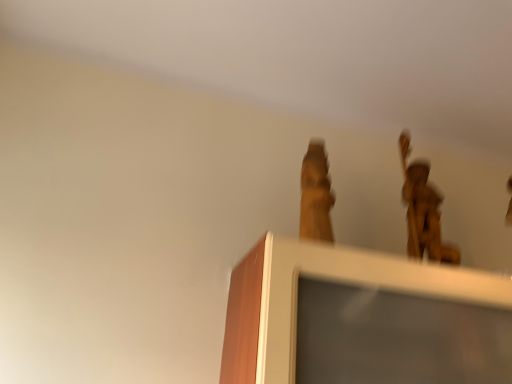
At what (x,y) coordinates should I click in order to perform the action: click on wooden frame at upper center. Please return your answer as a coordinate pair (x, y). Looking at the image, I should click on (362, 319).

Describe the element at coordinates (362, 319) in the screenshot. I see `wooden frame at upper center` at that location.

What is the approximate width of bronze statue at upper right?

It is 12.28 centimeters.

You are a GUI agent. You are given a task and a screenshot of the screen. Output one action in this format:
    pyautogui.click(x=<x>, y=<y>)
    Task: Click on the bronze statue at upper right
    
    Given the screenshot: What is the action you would take?
    pyautogui.click(x=423, y=211)

What do you see at coordinates (423, 211) in the screenshot?
I see `bronze statue at upper right` at bounding box center [423, 211].

Where is `wooden frame at upper center`? This screenshot has height=384, width=512. wooden frame at upper center is located at coordinates (362, 319).

Can you confirm if bronze statue at upper right is positioned to the right of wooden frame at upper center?

Indeed, bronze statue at upper right is positioned on the right side of wooden frame at upper center.

In the scene shown: Relative to wooden frame at upper center, is bronze statue at upper right in front or behind?

bronze statue at upper right is behind wooden frame at upper center.

Between point (405, 160) and point (317, 371), which one is positioned in front?

Positioned in front is point (317, 371).

From the image's perspective, between bronze statue at upper right and wooden frame at upper center, who is located below?

wooden frame at upper center, from the image's perspective.

From a real-world perspective, is bronze statue at upper right physically located above or below wooden frame at upper center?

Clearly, from a real-world perspective, bronze statue at upper right is above wooden frame at upper center.

Considering the relative sizes of bronze statue at upper right and wooden frame at upper center in the image provided, is bronze statue at upper right wider than wooden frame at upper center?

In fact, bronze statue at upper right might be narrower than wooden frame at upper center.

In terms of height, does bronze statue at upper right look taller or shorter compared to wooden frame at upper center?

bronze statue at upper right is taller than wooden frame at upper center.

Considering the relative sizes of bronze statue at upper right and wooden frame at upper center in the image provided, is bronze statue at upper right smaller than wooden frame at upper center?

Yes.

Could wooden frame at upper center be considered to be inside bronze statue at upper right?

That's incorrect, wooden frame at upper center is not inside bronze statue at upper right.

Is bronze statue at upper right not near wooden frame at upper center?

bronze statue at upper right is actually quite close to wooden frame at upper center.

Is bronze statue at upper right looking in the opposite direction of wooden frame at upper center?

No, bronze statue at upper right's orientation is not away from wooden frame at upper center.

What's the angular difference between bronze statue at upper right and wooden frame at upper center's facing directions?

The angular difference between bronze statue at upper right and wooden frame at upper center is 0.000222 degrees.

At what (x,y) coordinates should I click in order to perform the action: click on furniture below the bronze statue at upper right (from a real-world perspective). Please return your answer as a coordinate pair (x, y). The width and height of the screenshot is (512, 384). Looking at the image, I should click on (362, 319).

Visually, is wooden frame at upper center positioned to the left or to the right of bronze statue at upper right?

Clearly, wooden frame at upper center is on the left of bronze statue at upper right in the image.

Is wooden frame at upper center in front of or behind bronze statue at upper right in the image?

In the image, wooden frame at upper center appears in front of bronze statue at upper right.

Between point (395, 352) and point (403, 140), which one is positioned behind?

The point (403, 140) is more distant.

From the image's perspective, is wooden frame at upper center under bronze statue at upper right?

Correct, wooden frame at upper center appears lower than bronze statue at upper right in the image.

From a real-world perspective, is wooden frame at upper center physically above bronze statue at upper right?

Incorrect, from a real-world perspective, wooden frame at upper center is lower than bronze statue at upper right.

Considering the sizes of objects wooden frame at upper center and bronze statue at upper right in the image provided, who is thinner, wooden frame at upper center or bronze statue at upper right?

bronze statue at upper right.

Considering the relative sizes of wooden frame at upper center and bronze statue at upper right in the image provided, is wooden frame at upper center shorter than bronze statue at upper right?

Correct, wooden frame at upper center is not as tall as bronze statue at upper right.

Looking at the image, does wooden frame at upper center seem bigger or smaller compared to bronze statue at upper right?

Considering their sizes, wooden frame at upper center takes up more space than bronze statue at upper right.

Which is correct: wooden frame at upper center is inside bronze statue at upper right, or outside of it?

wooden frame at upper center cannot be found inside bronze statue at upper right.

Is wooden frame at upper center touching bronze statue at upper right?

No, wooden frame at upper center is not next to bronze statue at upper right.

Does wooden frame at upper center turn towards bronze statue at upper right?

No, wooden frame at upper center is not turned towards bronze statue at upper right.

You are a GUI agent. You are given a task and a screenshot of the screen. Output one action in this format:
    pyautogui.click(x=<x>, y=<y>)
    Task: Click on the bronze statue behind the wooden frame at upper center
    This screenshot has height=384, width=512.
    Given the screenshot: What is the action you would take?
    pyautogui.click(x=423, y=211)

You are a GUI agent. You are given a task and a screenshot of the screen. Output one action in this format:
    pyautogui.click(x=<x>, y=<y>)
    Task: Click on the furniture on the left of bronze statue at upper right
    This screenshot has width=512, height=384.
    Given the screenshot: What is the action you would take?
    pyautogui.click(x=362, y=319)

The height and width of the screenshot is (384, 512). What are the coordinates of `bronze statue to the right of wooden frame at upper center` in the screenshot? It's located at (423, 211).